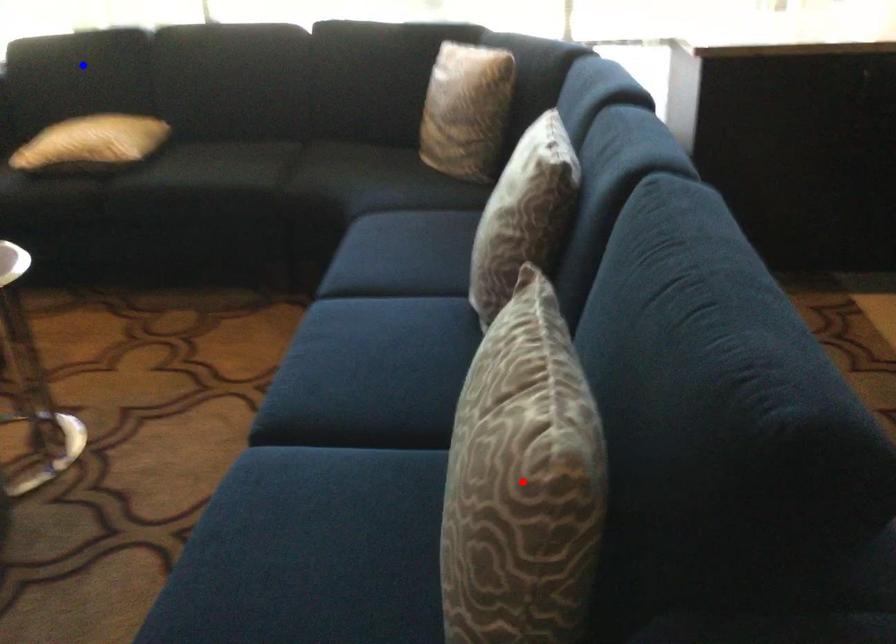
Question: Which of the two points in the image is closer to the camera?

Choices:
 (A) Blue point is closer.
 (B) Red point is closer.

Answer: (B)